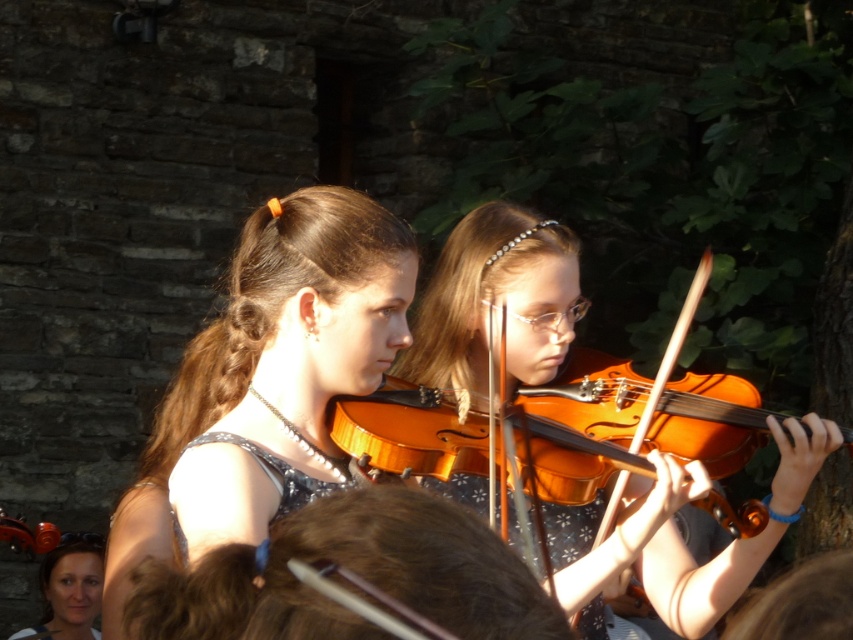
Question: Does brown hair at left appear on the left side of sparkly silver dress at center?

Choices:
 (A) yes
 (B) no

Answer: (B)

Question: Which point appears farthest from the camera in this image?

Choices:
 (A) (91, 541)
 (B) (126, 602)

Answer: (A)

Question: Based on their relative distances, which object is farther from the shiny brown hair at center?

Choices:
 (A) matte orange violin at center
 (B) brown hair at left
 (C) smooth skin face at lower left

Answer: (C)

Question: Estimate the real-world distances between objects in this image. Which object is farther from the brown hair at left?

Choices:
 (A) matte orange violin at center
 (B) shiny brown hair at center
 (C) smooth skin face at lower left

Answer: (C)

Question: Does brown hair at left appear on the left side of smooth skin face at lower left?

Choices:
 (A) yes
 (B) no

Answer: (B)

Question: Is brown hair at left to the right of smooth skin face at lower left from the viewer's perspective?

Choices:
 (A) yes
 (B) no

Answer: (A)